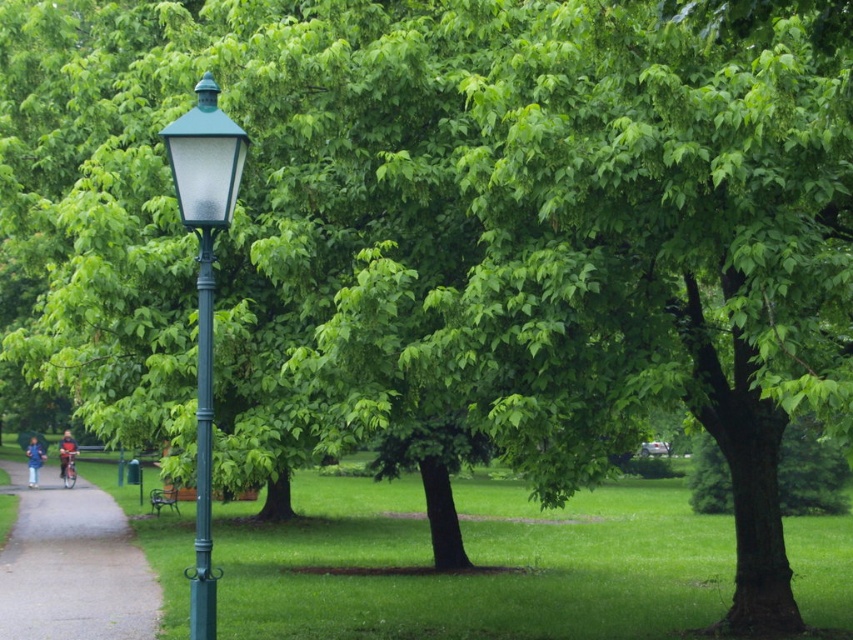
Is point (55, 632) more distant than point (210, 406)?

Yes.

The height and width of the screenshot is (640, 853). In order to click on gravel path at lower left in this screenshot , I will do `click(73, 566)`.

You are a GUI agent. You are given a task and a screenshot of the screen. Output one action in this format:
    pyautogui.click(x=<x>, y=<y>)
    Task: Click on the gravel path at lower left
    The image size is (853, 640).
    Given the screenshot: What is the action you would take?
    pyautogui.click(x=73, y=566)

Can you confirm if green matte pole at center-left is thinner than green metal bench at lower left?

Yes.

Does green matte pole at center-left appear under green metal bench at lower left?

Actually, green matte pole at center-left is above green metal bench at lower left.

Does point (207, 573) lie behind point (155, 493)?

That is False.

This screenshot has height=640, width=853. Find the location of `green matte pole at center-left`. green matte pole at center-left is located at coordinates (202, 451).

Is green matte street light at left taller than blue fabric umbrella at lower left?

Yes, green matte street light at left is taller than blue fabric umbrella at lower left.

Is point (207, 579) farther from camera compared to point (28, 467)?

No, (207, 579) is in front of (28, 467).

The width and height of the screenshot is (853, 640). I want to click on green matte street light at left, so click(x=204, y=292).